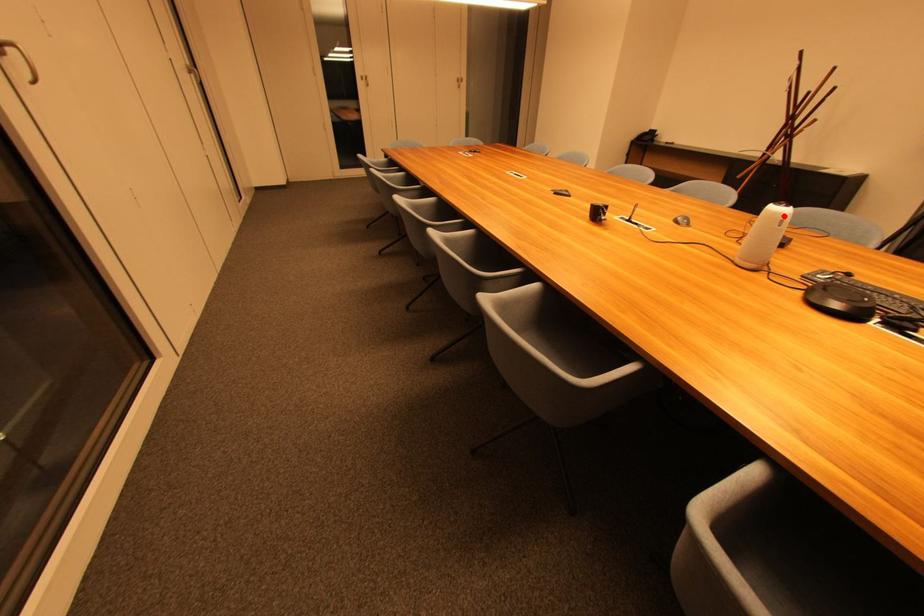
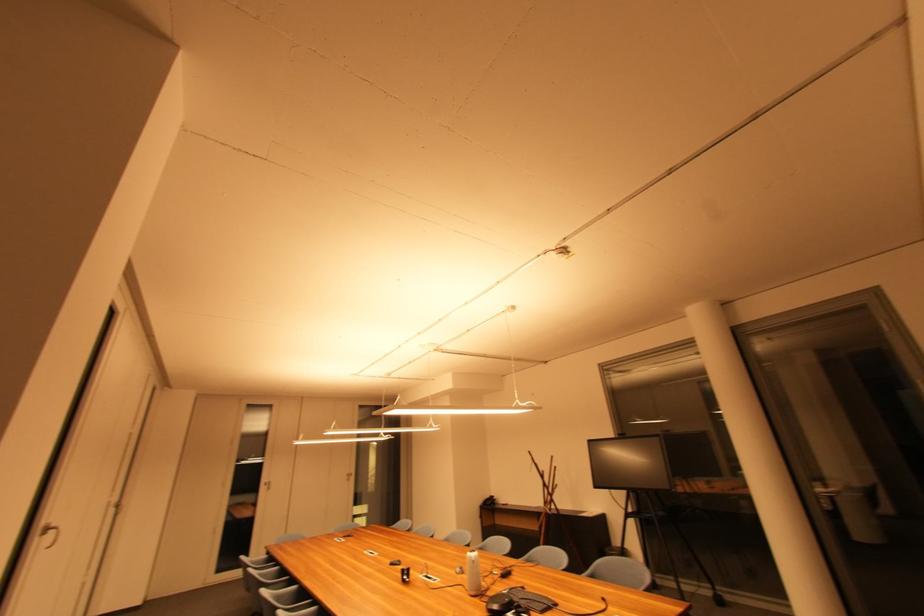
Question: A red point is marked in image1. In image2, is the corresponding 3D point closer to the camera or farther? Reply with the corresponding letter.

Choices:
 (A) The corresponding 3D point is closer.
 (B) The corresponding 3D point is farther.

Answer: (A)